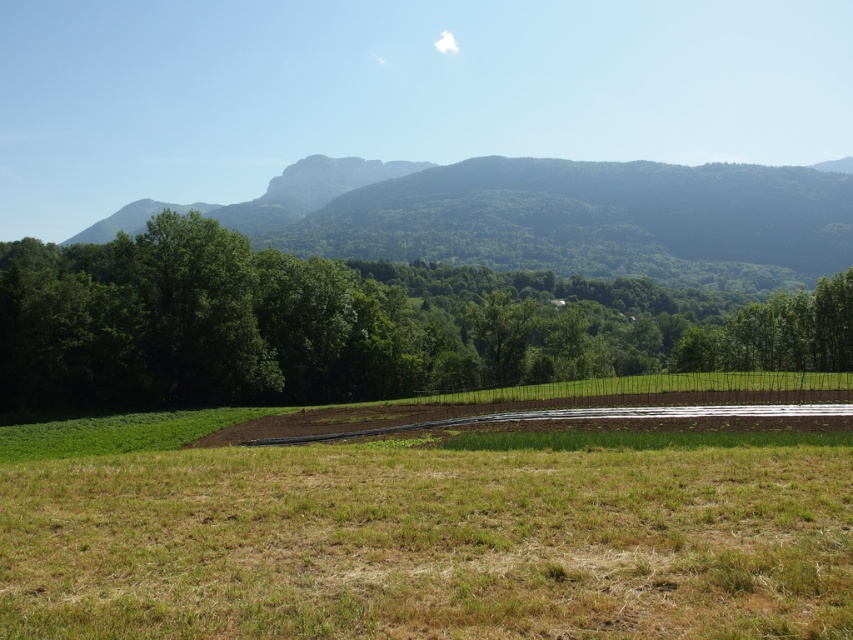
Question: Among these objects, which one is nearest to the camera?

Choices:
 (A) dry grass at center
 (B) green leafy tree at center

Answer: (A)

Question: Where is dry grass at center located in relation to green leafy tree at center in the image?

Choices:
 (A) above
 (B) below

Answer: (B)

Question: Which point is closer to the camera taking this photo?

Choices:
 (A) (646, 292)
 (B) (183, 584)

Answer: (B)

Question: Is dry grass at center below green leafy tree at center?

Choices:
 (A) no
 (B) yes

Answer: (B)

Question: Can you confirm if dry grass at center is positioned above green leafy tree at center?

Choices:
 (A) no
 (B) yes

Answer: (A)

Question: Which point is farther to the camera?

Choices:
 (A) green leafy tree at center
 (B) dry grass at center

Answer: (A)